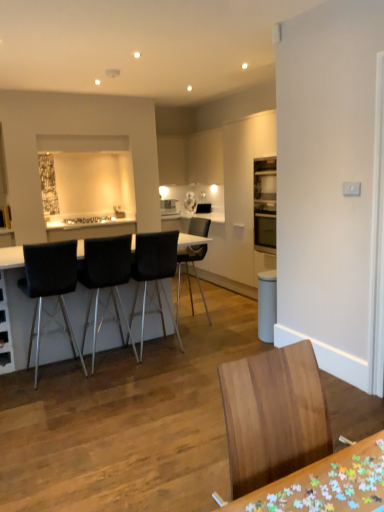
Question: Can you confirm if black leather chair at center, placed as the 5th chair when sorted from front to back, is wider than black leather table at center, the 1th table in the back-to-front sequence?

Choices:
 (A) no
 (B) yes

Answer: (A)

Question: Is black leather chair at center, placed as the 5th chair when sorted from front to back, located outside black leather table at center, placed as the 1th table when sorted from top to bottom?

Choices:
 (A) no
 (B) yes

Answer: (A)

Question: Is black leather chair at center, placed as the 5th chair when sorted from front to back, in front of black leather table at center, marked as the second table in a right-to-left arrangement?

Choices:
 (A) yes
 (B) no

Answer: (B)

Question: From a real-world perspective, is black leather chair at center, placed as the 5th chair when sorted from front to back, on black leather table at center, placed as the 1th table when sorted from top to bottom?

Choices:
 (A) yes
 (B) no

Answer: (A)

Question: Can you confirm if black leather chair at center, acting as the first chair starting from the back, is thinner than black leather table at center, positioned as the 2th table in front-to-back order?

Choices:
 (A) yes
 (B) no

Answer: (A)

Question: Considering the relative positions of black leather chair at center, the fourth chair from the front, and black leather table at center, positioned as the 2th table in front-to-back order, in the image provided, is black leather chair at center, the fourth chair from the front, to the left or to the right of black leather table at center, positioned as the 2th table in front-to-back order,?

Choices:
 (A) left
 (B) right

Answer: (B)

Question: Considering the positions of black leather chair at center, the 2th chair viewed from the back, and black leather table at center, marked as the second table in a right-to-left arrangement, in the image, is black leather chair at center, the 2th chair viewed from the back, wider or thinner than black leather table at center, marked as the second table in a right-to-left arrangement,?

Choices:
 (A) wide
 (B) thin

Answer: (B)

Question: From a real-world perspective, relative to black leather table at center, the 1th table in the back-to-front sequence, is black leather chair at center, the fourth chair from the front, vertically above or below?

Choices:
 (A) above
 (B) below

Answer: (A)

Question: Considering the positions of black leather chair at center, the fourth chair from the front, and black leather table at center, which appears as the 2th table when ordered from the bottom, in the image, is black leather chair at center, the fourth chair from the front, taller or shorter than black leather table at center, which appears as the 2th table when ordered from the bottom,?

Choices:
 (A) tall
 (B) short

Answer: (A)

Question: Considering the positions of white glossy microwave at upper center and black leather bar stool at left, arranged as the 3th chair when viewed from the front, in the image, is white glossy microwave at upper center wider or thinner than black leather bar stool at left, arranged as the 3th chair when viewed from the front,?

Choices:
 (A) wide
 (B) thin

Answer: (B)

Question: Based on their positions, is white glossy microwave at upper center located to the left or right of black leather bar stool at left, the 3th chair when ordered from back to front?

Choices:
 (A) left
 (B) right

Answer: (B)

Question: In the image, is white glossy microwave at upper center positioned in front of or behind black leather bar stool at left, the 3th chair when ordered from back to front?

Choices:
 (A) front
 (B) behind

Answer: (B)

Question: From a real-world perspective, relative to black leather bar stool at left, the 3th chair when ordered from back to front, is white glossy microwave at upper center vertically above or below?

Choices:
 (A) below
 (B) above

Answer: (B)

Question: Based on their sizes in the image, would you say wooden puzzle pieces at lower right, which appears as the 2th table when viewed from the back, is bigger or smaller than black leather chair at left, the 2th chair from the front?

Choices:
 (A) small
 (B) big

Answer: (A)

Question: In terms of height, does wooden puzzle pieces at lower right, which appears as the 2th table when viewed from the back, look taller or shorter compared to black leather chair at left, the 4th chair in the back-to-front sequence?

Choices:
 (A) tall
 (B) short

Answer: (B)